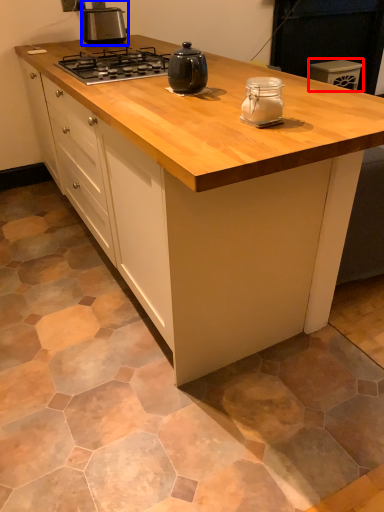
Question: Among these objects, which one is farthest to the camera, appliance (highlighted by a red box) or kitchen appliance (highlighted by a blue box)?

Choices:
 (A) appliance
 (B) kitchen appliance

Answer: (A)